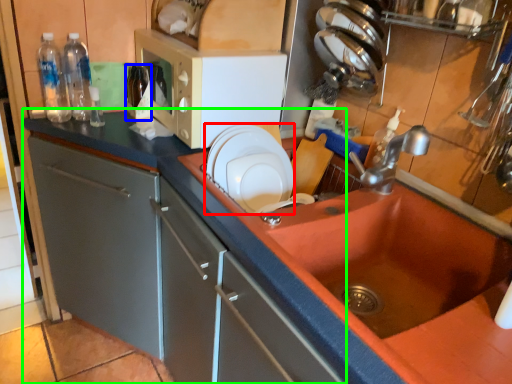
Question: Which object is the closest to the appliance (highlighted by a red box)? Choose among these: bottle (highlighted by a blue box) or countertop (highlighted by a green box).

Choices:
 (A) bottle
 (B) countertop

Answer: (B)